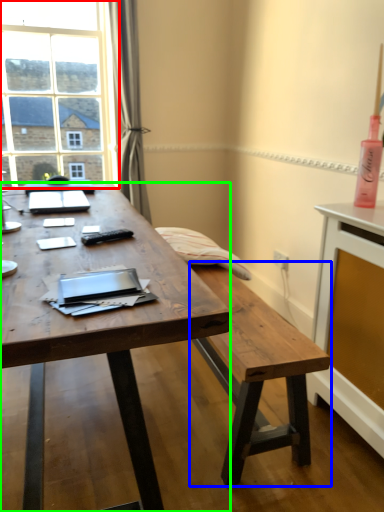
Question: Which object is the farthest from window (highlighted by a red box)? Choose among these: bench (highlighted by a blue box) or desk (highlighted by a green box).

Choices:
 (A) bench
 (B) desk

Answer: (A)